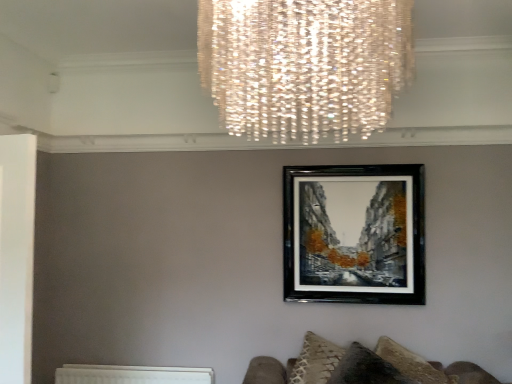
Question: Is velvet textured cushion at lower right to the left or to the right of black glossy picture frame at center in the image?

Choices:
 (A) left
 (B) right

Answer: (B)

Question: Is velvet textured cushion at lower right situated inside black glossy picture frame at center or outside?

Choices:
 (A) inside
 (B) outside

Answer: (B)

Question: Estimate the real-world distances between objects in this image. Which object is closer to the velvet textured cushion at lower right?

Choices:
 (A) white textured radiator at lower left
 (B) black glossy picture frame at center

Answer: (B)

Question: Estimate the real-world distances between objects in this image. Which object is farther from the white textured radiator at lower left?

Choices:
 (A) velvet textured cushion at lower right
 (B) black glossy picture frame at center

Answer: (B)